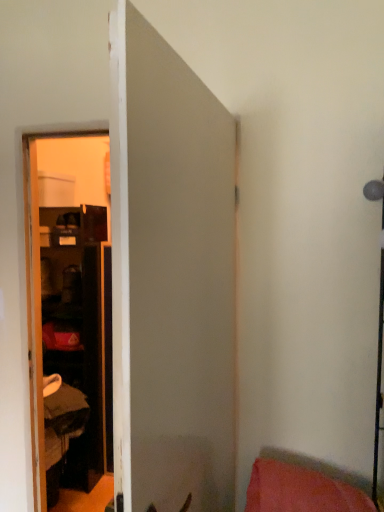
Question: Looking at the image, does pink fabric pillow at lower right seem bigger or smaller compared to white matte door at center?

Choices:
 (A) big
 (B) small

Answer: (B)

Question: Is pink fabric pillow at lower right spatially inside white matte door at center, or outside of it?

Choices:
 (A) inside
 (B) outside

Answer: (B)

Question: In the image, is pink fabric pillow at lower right on the left side or the right side of white matte door at center?

Choices:
 (A) left
 (B) right

Answer: (B)

Question: Is white matte door at center in front of or behind pink fabric pillow at lower right in the image?

Choices:
 (A) front
 (B) behind

Answer: (A)

Question: Is point (230, 130) closer or farther from the camera than point (360, 500)?

Choices:
 (A) closer
 (B) farther

Answer: (B)

Question: Which is correct: white matte door at center is inside pink fabric pillow at lower right, or outside of it?

Choices:
 (A) inside
 (B) outside

Answer: (B)

Question: Looking at their shapes, would you say white matte door at center is wider or thinner than pink fabric pillow at lower right?

Choices:
 (A) thin
 (B) wide

Answer: (A)